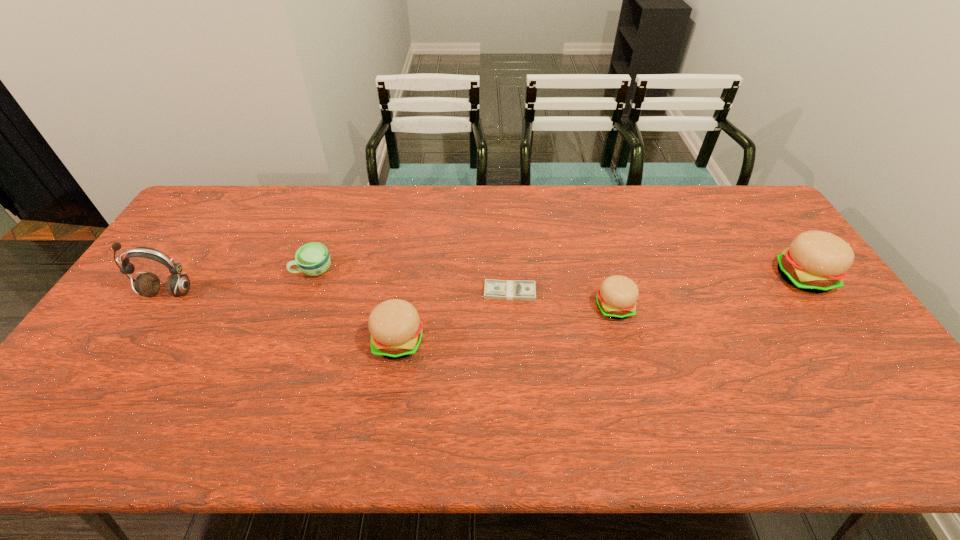
Please point a spot on the left to add another hamburger. Please provide its 2D coordinates. Your answer should be formatted as a tuple, i.e. [(x, y)], where the tuple contains the x and y coordinates of a point satisfying the conditions above.

[(152, 381)]